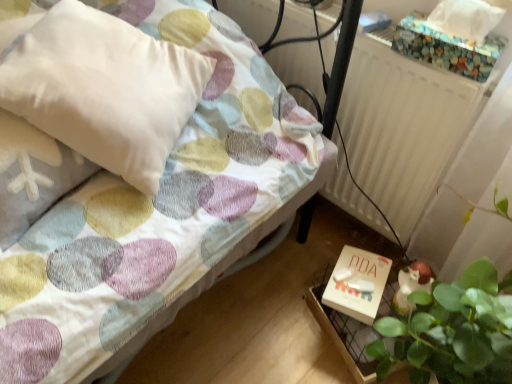
Question: Is white matte box at lower right behind white matte radiator at upper right?

Choices:
 (A) no
 (B) yes

Answer: (B)

Question: Is white matte box at lower right completely or partially outside of white matte radiator at upper right?

Choices:
 (A) no
 (B) yes

Answer: (B)

Question: Can you confirm if white matte box at lower right is shorter than white matte radiator at upper right?

Choices:
 (A) no
 (B) yes

Answer: (B)

Question: From the image's perspective, is white matte box at lower right on white matte radiator at upper right?

Choices:
 (A) yes
 (B) no

Answer: (B)

Question: From a real-world perspective, does white matte box at lower right stand above white matte radiator at upper right?

Choices:
 (A) yes
 (B) no

Answer: (B)

Question: Would you say white matte box at lower right is a long distance from white matte radiator at upper right?

Choices:
 (A) no
 (B) yes

Answer: (A)

Question: Are white matte box at lower right and pastel polka dot fabric bed at center located far from each other?

Choices:
 (A) no
 (B) yes

Answer: (A)

Question: Is white matte box at lower right smaller than pastel polka dot fabric bed at center?

Choices:
 (A) no
 (B) yes

Answer: (B)

Question: From the image's perspective, is white matte box at lower right under pastel polka dot fabric bed at center?

Choices:
 (A) no
 (B) yes

Answer: (B)

Question: Is white matte box at lower right closer to the viewer compared to pastel polka dot fabric bed at center?

Choices:
 (A) yes
 (B) no

Answer: (B)

Question: Can you confirm if white matte box at lower right is bigger than pastel polka dot fabric bed at center?

Choices:
 (A) yes
 (B) no

Answer: (B)

Question: Is white matte box at lower right oriented towards pastel polka dot fabric bed at center?

Choices:
 (A) yes
 (B) no

Answer: (A)

Question: Can you confirm if white matte radiator at upper right is thinner than white matte box at lower right?

Choices:
 (A) no
 (B) yes

Answer: (B)